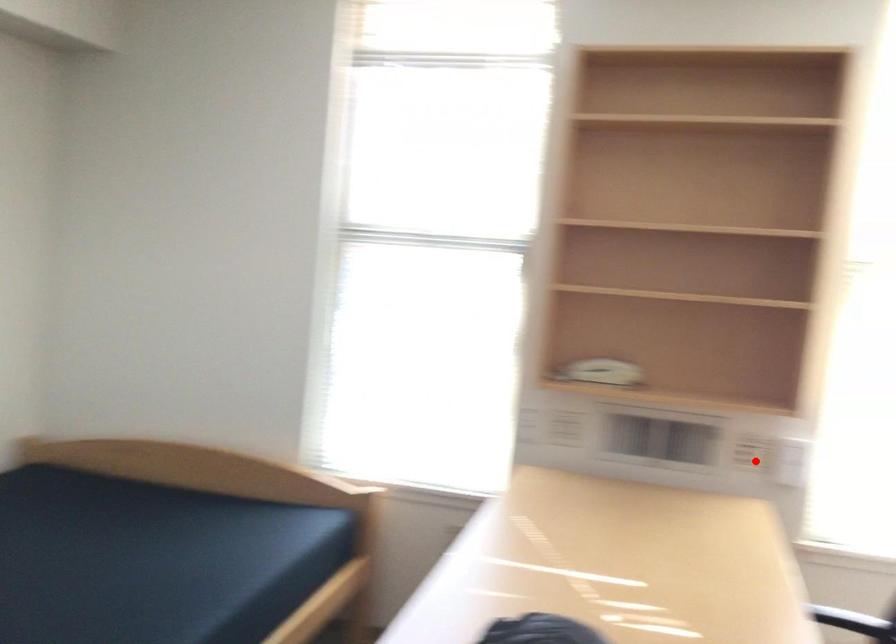
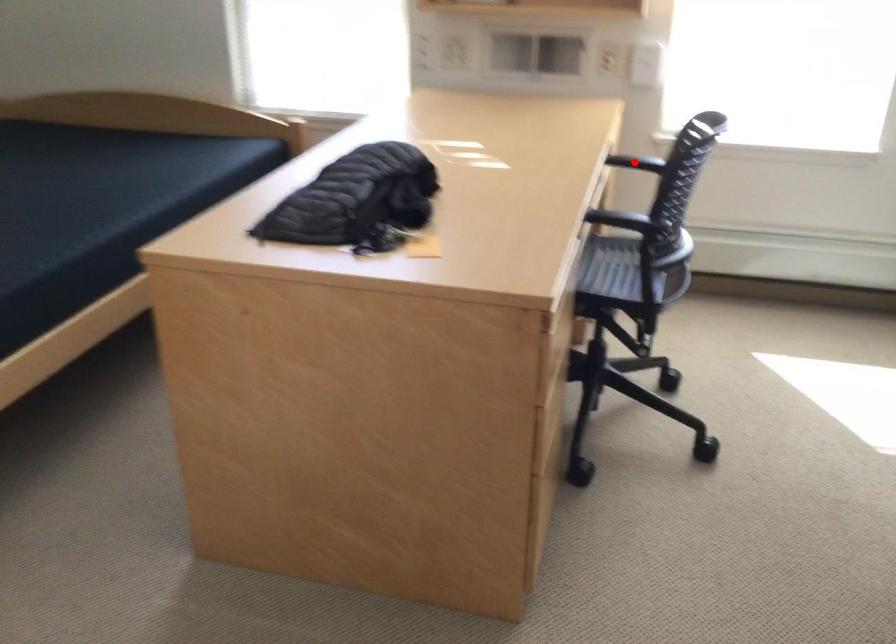
I am providing you with two images of the same scene from different viewpoints. A red point is marked on the first image and another point is marked on the second image. Do the highlighted points in image1 and image2 indicate the same real-world spot?

No